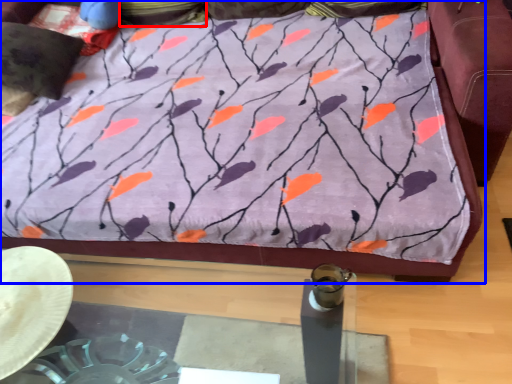
Question: Which object is closer to the camera taking this photo, pillow (highlighted by a red box) or furniture (highlighted by a blue box)?

Choices:
 (A) pillow
 (B) furniture

Answer: (B)